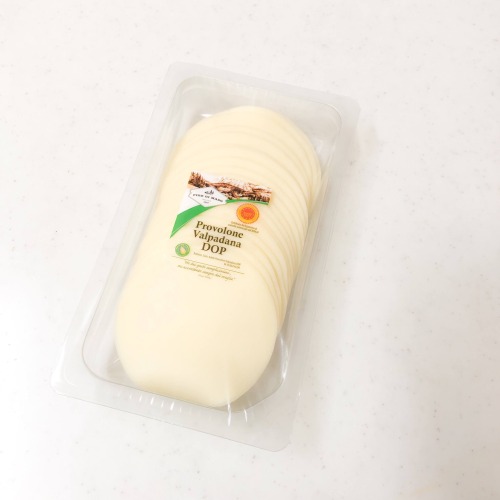
The height and width of the screenshot is (500, 500). What are the coordinates of `tray` in the screenshot? It's located at (277, 419).